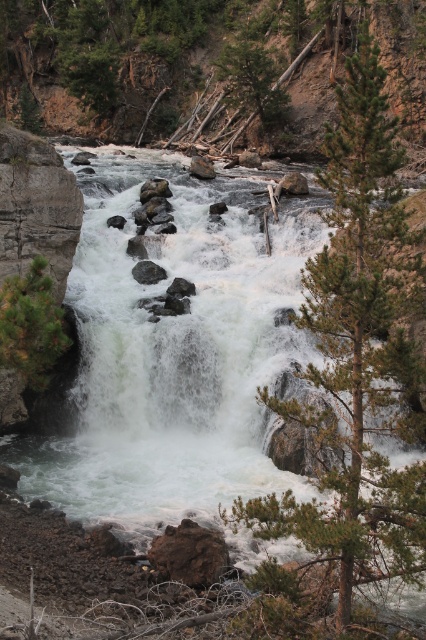
Who is taller, green matte tree at left or gray smooth rock at center?

With more height is green matte tree at left.

Looking at this image, which of these two, green matte tree at left or gray smooth rock at center, stands shorter?

With less height is gray smooth rock at center.

The height and width of the screenshot is (640, 426). Find the location of `green matte tree at left`. green matte tree at left is located at coordinates (31, 324).

What do you see at coordinates (147, 273) in the screenshot? This screenshot has width=426, height=640. I see `gray smooth rock at center` at bounding box center [147, 273].

The width and height of the screenshot is (426, 640). In order to click on gray smooth rock at center in this screenshot , I will do `click(147, 273)`.

Is point (155, 278) farther from viewer compared to point (201, 161)?

No.

Where is `gray smooth rock at center`? This screenshot has width=426, height=640. gray smooth rock at center is located at coordinates (147, 273).

Is point (389, 257) more distant than point (201, 164)?

No, (389, 257) is closer to viewer.

What are the coordinates of `green needle-like tree at center-right` in the screenshot? It's located at (359, 355).